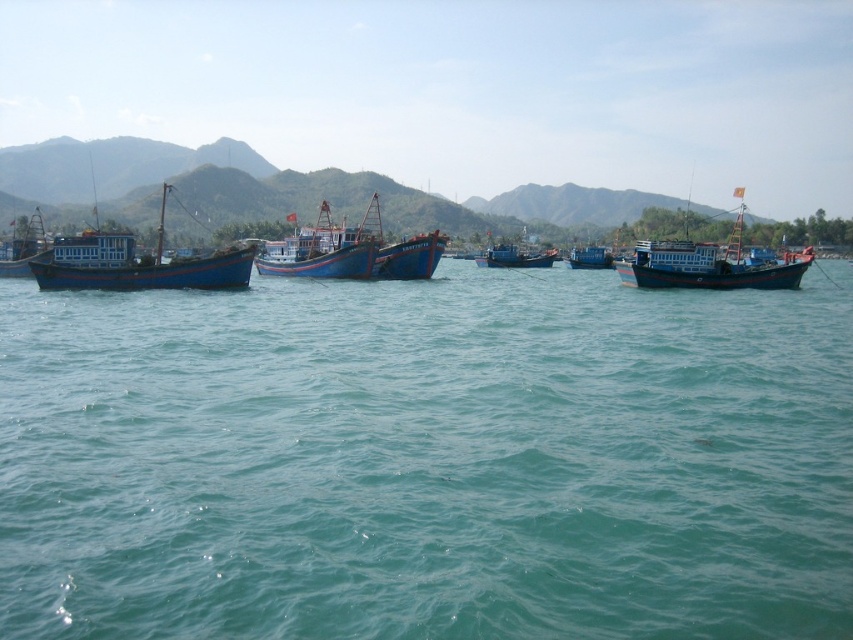
Question: Estimate the real-world distances between objects in this image. Which object is farther from the blue wooden boat at center?

Choices:
 (A) blue painted wooden boat at center
 (B) green textured mountain at upper left

Answer: (B)

Question: Does blue wooden boat at left appear on the right side of blue wooden boat at center?

Choices:
 (A) no
 (B) yes

Answer: (A)

Question: Does blue wooden boat at right have a larger size compared to blue painted wooden fishing boat at center?

Choices:
 (A) no
 (B) yes

Answer: (B)

Question: Which point appears farthest from the camera in this image?

Choices:
 (A) (283, 237)
 (B) (48, 262)

Answer: (A)

Question: Is teal water at center closer to the viewer compared to blue wooden boat at left?

Choices:
 (A) no
 (B) yes

Answer: (B)

Question: Which point is farther from the camera taking this photo?

Choices:
 (A) (456, 221)
 (B) (22, 275)
 (C) (247, 256)
 (D) (527, 266)

Answer: (A)